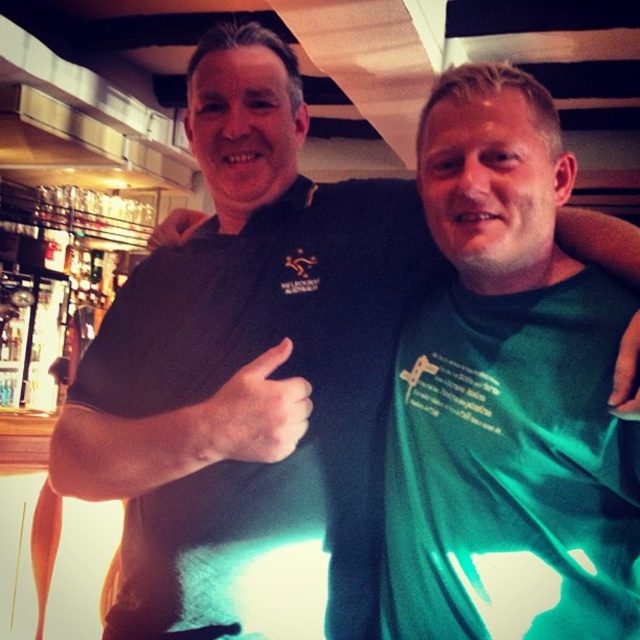
You are a photographer trying to capture a candid shot of the two people in the scene. You notice the matte black thumb at center and the matte black hand at upper center. Which object should you avoid blocking the camera lens to ensure you capture both subjects clearly?

You should avoid blocking the matte black thumb at center because it is positioned to the right of the matte black hand at upper center, so it is closer to the camera lens and could obstruct the view of the hand if not properly framed.

You are a bartender who needs to hang a new menu between the green fabric hand at upper right and the matte black hand at upper center. The menu is 60 centimeters wide. Can you fit it between them without overlapping?

The distance between the green fabric hand at upper right and the matte black hand at upper center is 78.40 centimeters. Since the menu is 60 centimeters wide, there is enough space to fit it between them without overlapping.